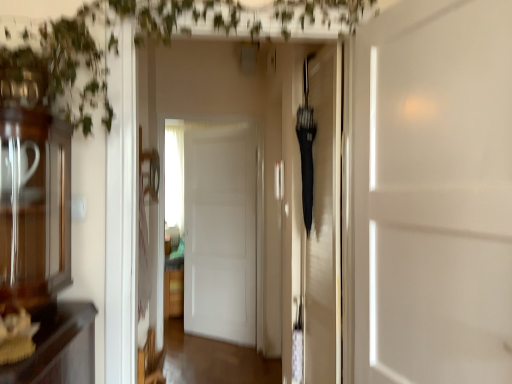
Question: Is green leafy plant at upper left far from white matte door at center, marked as the 3th door in a right-to-left arrangement?

Choices:
 (A) no
 (B) yes

Answer: (B)

Question: Does green leafy plant at upper left have a greater height compared to white matte door at center, the 3th door from the front?

Choices:
 (A) yes
 (B) no

Answer: (B)

Question: Is green leafy plant at upper left shorter than white matte door at center, which is the first door from back to front?

Choices:
 (A) yes
 (B) no

Answer: (A)

Question: Is green leafy plant at upper left at the right side of white matte door at center, the 3th door from the front?

Choices:
 (A) no
 (B) yes

Answer: (B)

Question: Is green leafy plant at upper left positioned before white matte door at center, which is the first door from back to front?

Choices:
 (A) no
 (B) yes

Answer: (B)

Question: From their relative heights in the image, would you say green leafy plant at upper left is taller or shorter than white matte door at center, arranged as the first door when viewed from the front?

Choices:
 (A) tall
 (B) short

Answer: (B)

Question: Is point (100, 102) closer or farther from the camera than point (506, 109)?

Choices:
 (A) farther
 (B) closer

Answer: (A)

Question: Is green leafy plant at upper left bigger or smaller than white matte door at center, placed as the 3th door when sorted from back to front?

Choices:
 (A) big
 (B) small

Answer: (A)

Question: In terms of width, does green leafy plant at upper left look wider or thinner when compared to white matte door at center, placed as the 3th door when sorted from back to front?

Choices:
 (A) thin
 (B) wide

Answer: (B)

Question: Considering the relative positions of white matte door at center, arranged as the first door when viewed from the front, and white matte door at center, marked as the 3th door in a right-to-left arrangement, in the image provided, is white matte door at center, arranged as the first door when viewed from the front, to the left or to the right of white matte door at center, marked as the 3th door in a right-to-left arrangement,?

Choices:
 (A) right
 (B) left

Answer: (A)

Question: Is point (391, 329) closer or farther from the camera than point (252, 130)?

Choices:
 (A) farther
 (B) closer

Answer: (B)

Question: Is white matte door at center, placed as the 3th door when sorted from back to front, wider or thinner than white matte door at center, the 3th door from the front?

Choices:
 (A) wide
 (B) thin

Answer: (A)

Question: From a real-world perspective, is white matte door at center, placed as the 3th door when sorted from back to front, positioned above or below white matte door at center, the 3th door from the front?

Choices:
 (A) below
 (B) above

Answer: (B)

Question: From the image's perspective, is black matte umbrella at center, the 2th door positioned from the left, positioned above or below green leafy plant at upper left?

Choices:
 (A) below
 (B) above

Answer: (A)

Question: Based on their positions, is black matte umbrella at center, which is the second door in front-to-back order, located to the left or right of green leafy plant at upper left?

Choices:
 (A) right
 (B) left

Answer: (A)